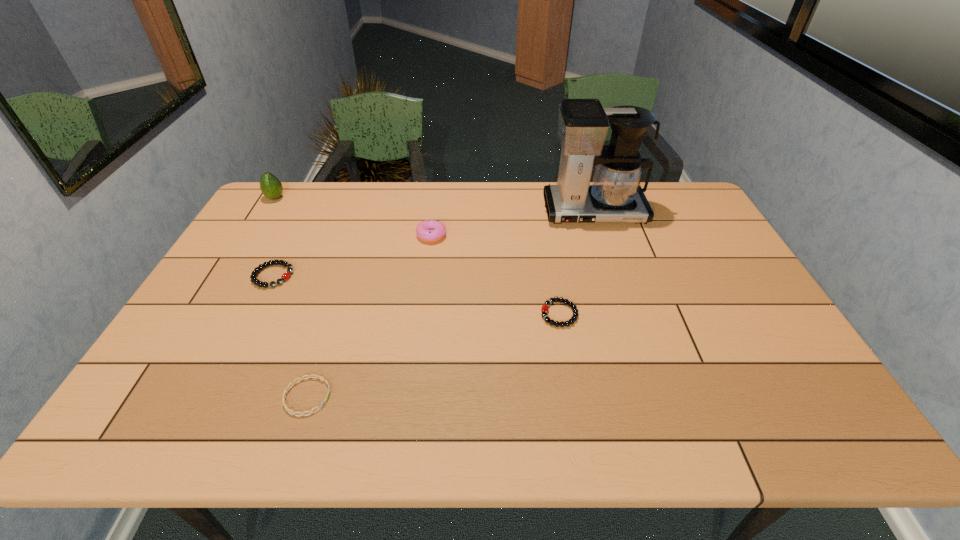
Locate an element on the screen. This screenshot has height=540, width=960. the shortest bracelet is located at coordinates (309, 376).

This screenshot has width=960, height=540. What are the coordinates of `free space located 0.070m at the front of the coffee maker where the controls are located` in the screenshot? It's located at (604, 242).

The image size is (960, 540). In order to click on free space located on the front of the leftmost object in this screenshot , I will do `click(254, 233)`.

Where is `vacant space located 0.140m on the left of the third object from right to left`? This screenshot has width=960, height=540. vacant space located 0.140m on the left of the third object from right to left is located at coordinates (373, 235).

The image size is (960, 540). Identify the location of free space located on the right of the farthest bracelet. (368, 276).

This screenshot has width=960, height=540. I want to click on vacant space located 0.280m on the left of the rightmost bracelet, so click(436, 314).

Identify the location of free spot located 0.080m on the surface of the nearest object showing star-shaped elements. (365, 396).

This screenshot has width=960, height=540. I want to click on coffee maker located at the far edge, so click(615, 196).

Find the location of a particular element. This screenshot has height=540, width=960. avocado that is at the far edge is located at coordinates (271, 187).

Locate an element on the screen. Image resolution: width=960 pixels, height=540 pixels. object that is at the near edge is located at coordinates (309, 376).